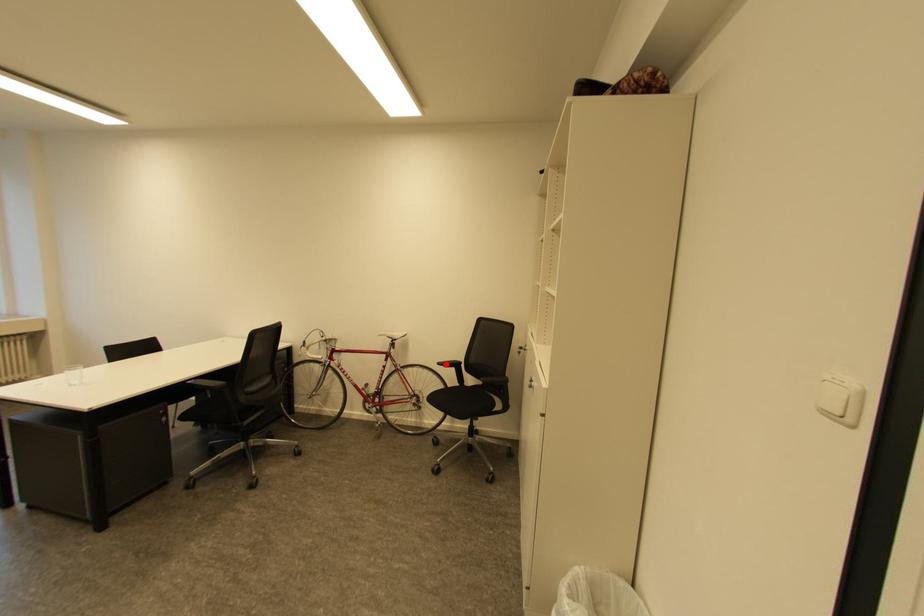
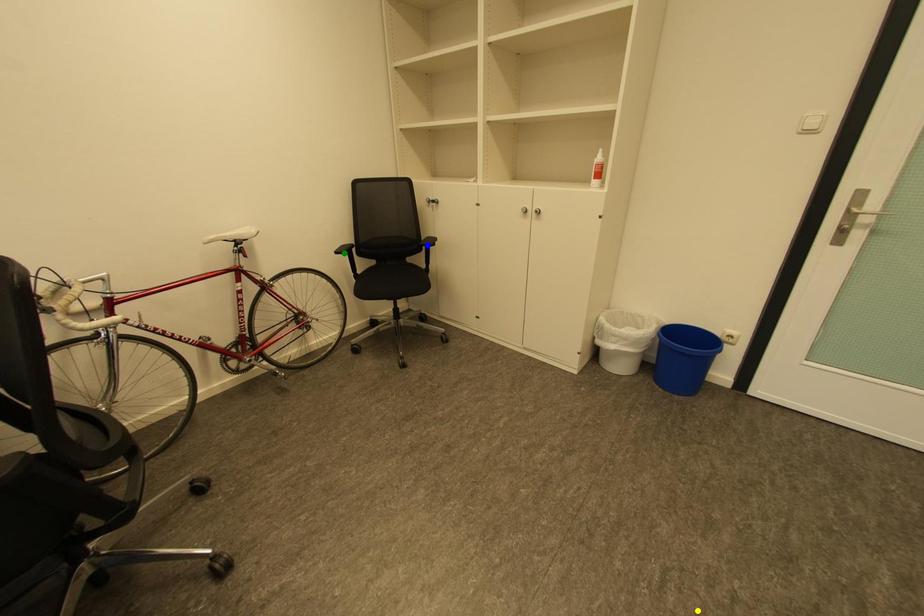
Question: I am providing you with two images of the same scene from different viewpoints. A red point is marked on the first image. You are given multiple points on the second image. Which point in image 2 represents the same 3d spot as the red point in image 1?

Choices:
 (A) yellow point
 (B) blue point
 (C) green point

Answer: (C)